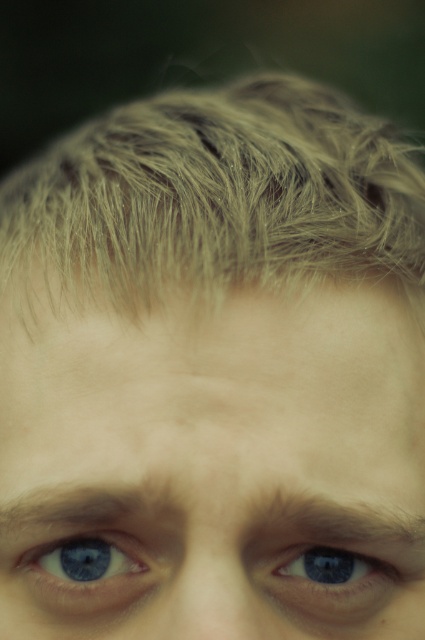
You are a photographer adjusting the focus of your camera. The subject has blonde textured hair at upper center. Where should you position the focus point to ensure the hair is in sharp focus?

The focus point should be positioned at coordinates point [218,196] to ensure the blonde textured hair at upper center is in sharp focus.

Looking at this image, you are a photographer adjusting the lighting for a portrait. You notice the blue glossy eye at center and the blue glossy eye at lower left in your viewfinder. Which eye is positioned to the right side of the other?

The blue glossy eye at center is positioned to the right of the blue glossy eye at lower left.

You are a photographer adjusting the focus on a camera. You need to ensure that both the blonde textured hair at upper center and the blue glossy eye at lower left are in focus. Which object should you focus on first to achieve this?

To ensure both the blonde textured hair at upper center and the blue glossy eye at lower left are in focus, you should focus on the blue glossy eye at lower left first since it is closer to the camera than the blonde textured hair at upper center.